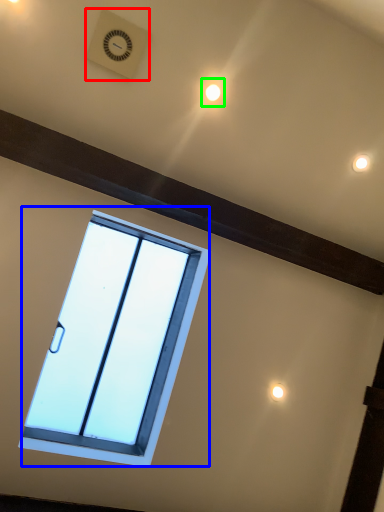
Question: Which is farther away from clock (highlighted by a red box)? window (highlighted by a blue box) or light (highlighted by a green box)?

Choices:
 (A) window
 (B) light

Answer: (A)